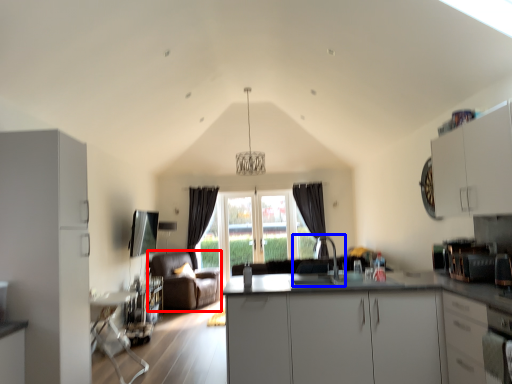
Question: Which point is further to the camera, armchair (highlighted by a red box) or sink (highlighted by a blue box)?

Choices:
 (A) armchair
 (B) sink

Answer: (A)